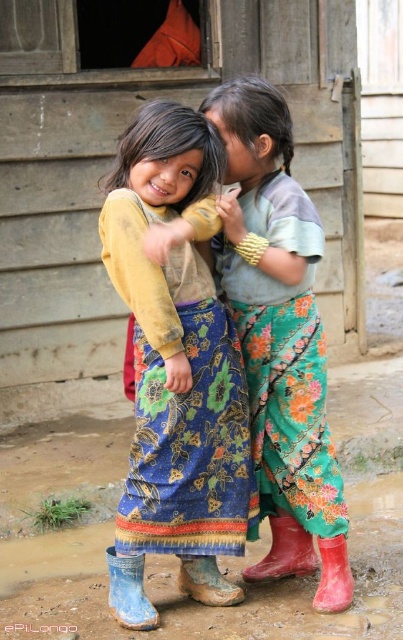
Which is more to the left, floral fabric skirt at center or red rubber boot at lower center?

Positioned to the left is floral fabric skirt at center.

Who is more forward, (x=261, y=104) or (x=319, y=582)?

Point (x=261, y=104) is in front.

Where is `floral fabric skirt at center`? floral fabric skirt at center is located at coordinates (276, 323).

Is point (284, 209) positioned in front of point (141, 627)?

No, (284, 209) is further to viewer.

Which is below, floral fabric skirt at center or blue rubber boot at lower left?

blue rubber boot at lower left is lower down.

Where is `floral fabric skirt at center`? floral fabric skirt at center is located at coordinates (276, 323).

At what (x,y) coordinates should I click in order to perform the action: click on floral fabric skirt at center. Please return your answer as a coordinate pair (x, y). This screenshot has height=640, width=403. Looking at the image, I should click on (276, 323).

Is blue rubber boot at lower left closer to the viewer compared to red rubber boot at lower center?

Yes, it is in front of red rubber boot at lower center.

Does blue rubber boot at lower left appear under red rubber boot at lower center?

Correct, blue rubber boot at lower left is located below red rubber boot at lower center.

Locate an element on the screen. The width and height of the screenshot is (403, 640). blue rubber boot at lower left is located at coordinates tap(128, 592).